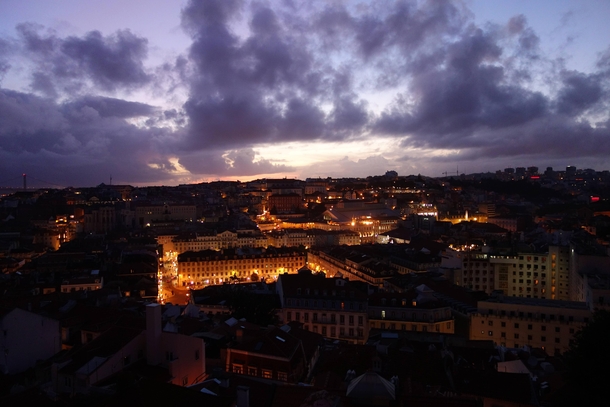
Find the location of a particular element. This screenshot has width=610, height=407. the top of pink chimney is located at coordinates (152, 303).